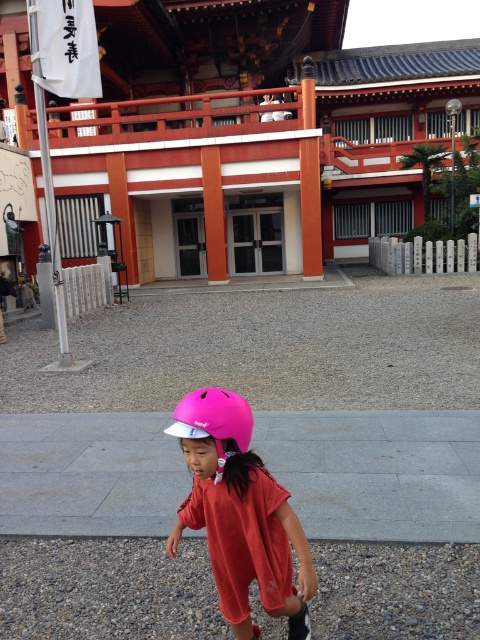
Is pink matte helmet at center above pink matte helmet at lower center?

Actually, pink matte helmet at center is below pink matte helmet at lower center.

Measure the distance between pink matte helmet at center and camera.

pink matte helmet at center and camera are 6.70 feet apart from each other.

Locate an element on the screen. This screenshot has width=480, height=640. pink matte helmet at center is located at coordinates (240, 513).